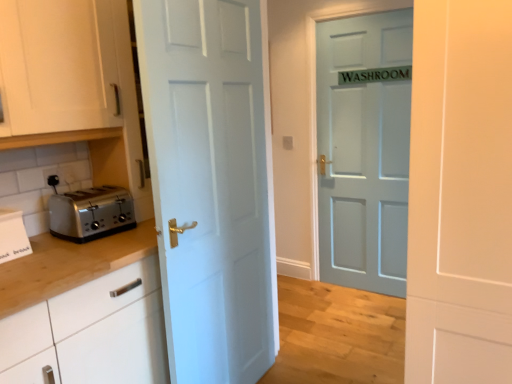
Find the location of a particular element. The width and height of the screenshot is (512, 384). vacant space positioned to the left of light blue matte door at center, the third door viewed from the front is located at coordinates pos(316,292).